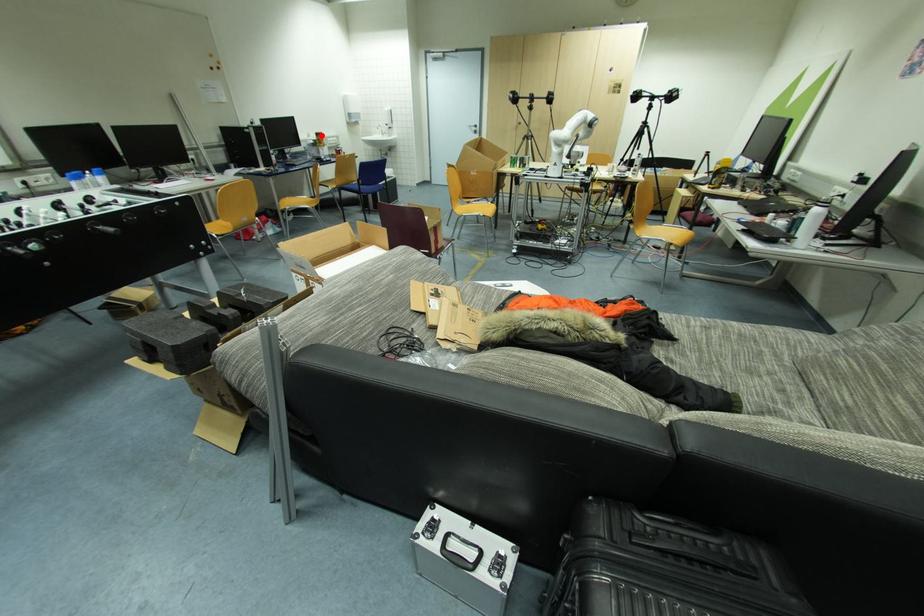
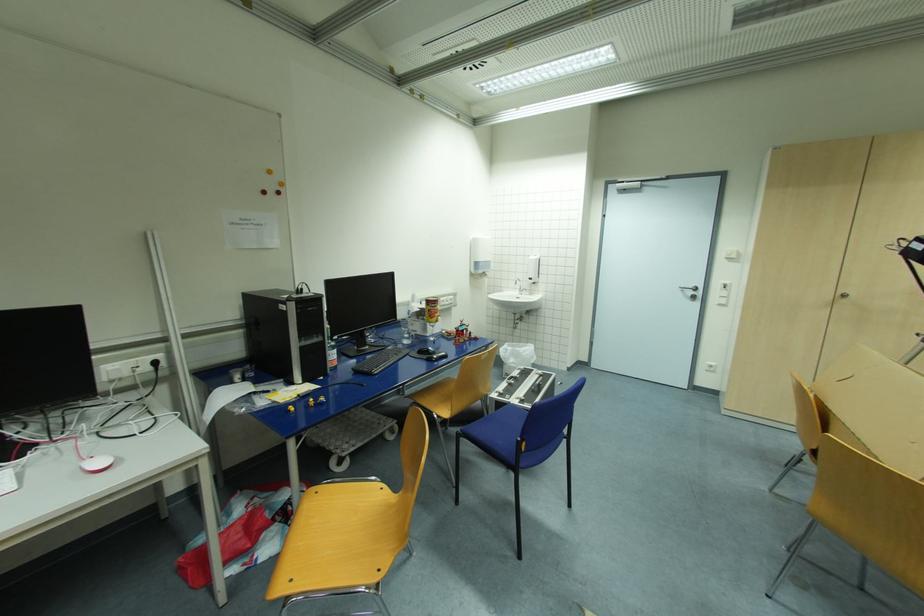
Locate, in the second image, the point that corresponds to the highlighted location in the first image.

(433, 302)